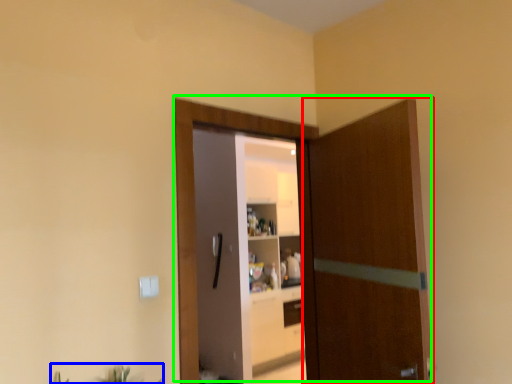
Question: Which is farther away from door (highlighted by a red box)? plant (highlighted by a blue box) or door (highlighted by a green box)?

Choices:
 (A) plant
 (B) door

Answer: (A)